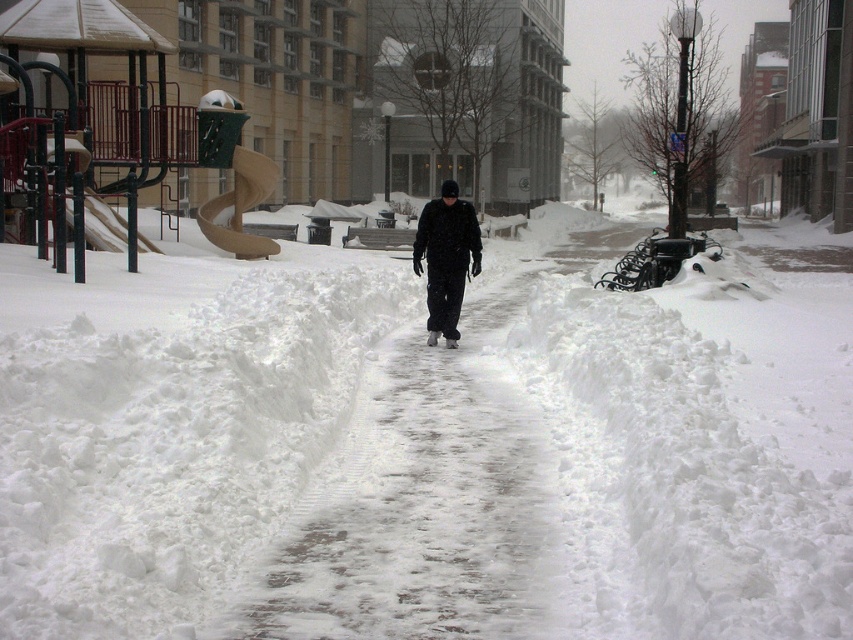
Consider the image. You are a photographer standing at the edge of the snowy pathway. You want to take a photo that includes both the white fluffy snow at center and the black matte jacket at center. Which object will appear larger in the photo?

The white fluffy snow at center will appear larger in the photo because it is closer to the viewer than the black matte jacket at center.

You are standing at the edge of the snowy pathway and want to reach the playground on the left. There is white fluffy snow at center in your way. Can you walk around it? Please explain.

The white fluffy snow at center is 13.41 feet away from you. Since it is just snow on the ground, you can easily walk around it to reach the playground on the left.

You are a photographer trying to capture the contrast between the white fluffy snow at center and the black matte jacket at center. Which object is closer to the camera based on their positions?

The black matte jacket at center is closer to the camera because the white fluffy snow at center is positioned under it, indicating it is behind.